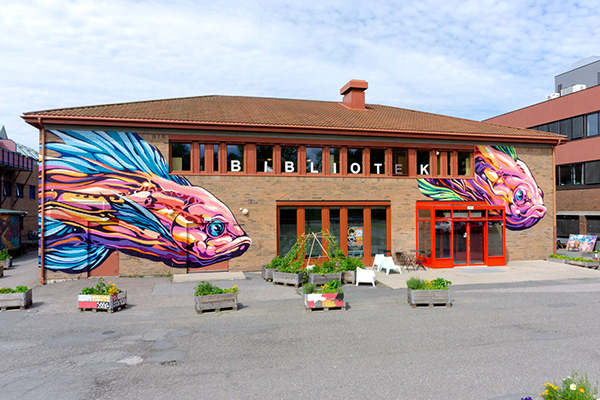
Identify the location of plant boxes. The width and height of the screenshot is (600, 400). (327, 295), (420, 290), (212, 299), (100, 296), (7, 300), (280, 273).